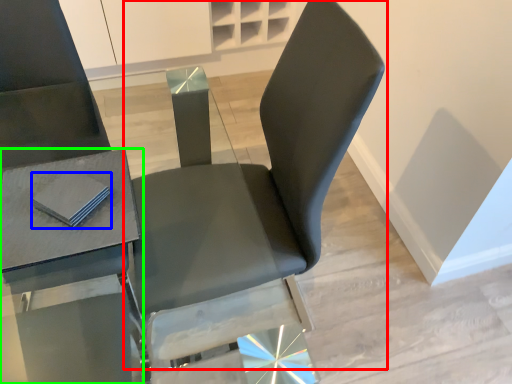
Question: Which object is positioned closest to chair (highlighted by a red box)? Select from pad (highlighted by a blue box) and table (highlighted by a green box).

Choices:
 (A) pad
 (B) table

Answer: (B)